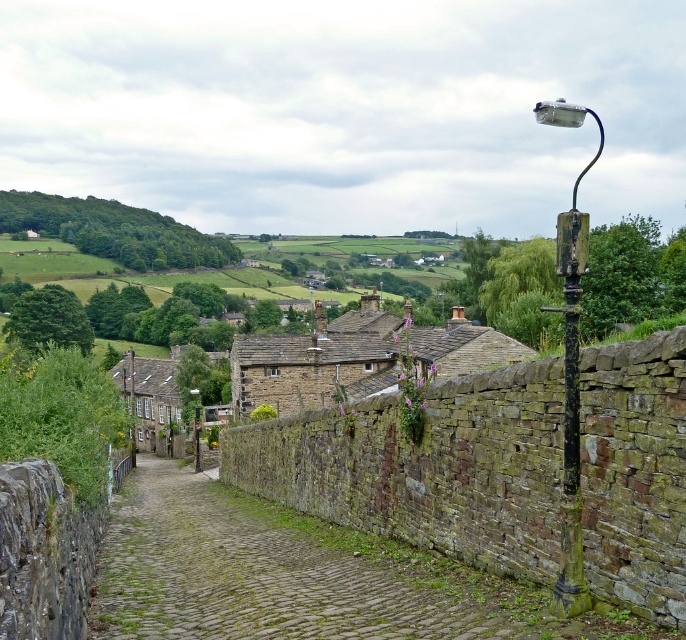
Which of these two, green mossy cobblestone path at center or rusty metal streetlamp at right, stands taller?

rusty metal streetlamp at right is taller.

The image size is (686, 640). I want to click on green mossy cobblestone path at center, so click(279, 572).

Is brown stone houses at center closer to camera compared to rusty metal streetlamp at right?

No, brown stone houses at center is further to the viewer.

Which is in front, point (201, 396) or point (567, 563)?

Point (567, 563) is in front.

Where is `brown stone houses at center`? brown stone houses at center is located at coordinates (314, 364).

Between green mossy cobblestone path at center and brown stone houses at center, which one is positioned higher?

brown stone houses at center is above.

Does green mossy cobblestone path at center come behind brown stone houses at center?

No.

Does point (187, 500) come farther from viewer compared to point (123, 397)?

No, it is not.

I want to click on green mossy cobblestone path at center, so click(x=279, y=572).